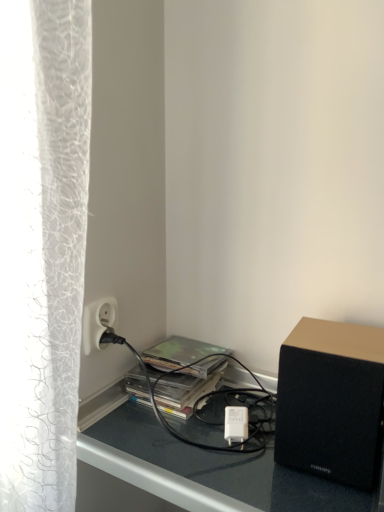
Question: Are black matte speaker at lower right and camouflage paper at center beside each other?

Choices:
 (A) yes
 (B) no

Answer: (B)

Question: Is camouflage paper at center surrounded by black matte speaker at lower right?

Choices:
 (A) no
 (B) yes

Answer: (A)

Question: Is black matte speaker at lower right positioned with its back to camouflage paper at center?

Choices:
 (A) no
 (B) yes

Answer: (A)

Question: Is black matte speaker at lower right taller than camouflage paper at center?

Choices:
 (A) no
 (B) yes

Answer: (B)

Question: From a real-world perspective, is black matte speaker at lower right physically above camouflage paper at center?

Choices:
 (A) yes
 (B) no

Answer: (A)

Question: Is white plastic power outlet at lower left inside or outside of black matte speaker at lower right?

Choices:
 (A) inside
 (B) outside

Answer: (B)

Question: Looking at their shapes, would you say white plastic power outlet at lower left is wider or thinner than black matte speaker at lower right?

Choices:
 (A) thin
 (B) wide

Answer: (A)

Question: Is white plastic power outlet at lower left taller or shorter than black matte speaker at lower right?

Choices:
 (A) tall
 (B) short

Answer: (B)

Question: From the image's perspective, is white plastic power outlet at lower left above or below black matte speaker at lower right?

Choices:
 (A) above
 (B) below

Answer: (A)

Question: From the image's perspective, relative to white plastic power outlet at lower left, is black matte speaker at lower right above or below?

Choices:
 (A) below
 (B) above

Answer: (A)

Question: In the image, is black matte speaker at lower right positioned in front of or behind white plastic power outlet at lower left?

Choices:
 (A) front
 (B) behind

Answer: (A)

Question: Considering the positions of point (349, 411) and point (99, 307), is point (349, 411) closer or farther from the camera than point (99, 307)?

Choices:
 (A) farther
 (B) closer

Answer: (B)

Question: Based on their sizes in the image, would you say black matte speaker at lower right is bigger or smaller than white plastic power outlet at lower left?

Choices:
 (A) small
 (B) big

Answer: (B)

Question: From their relative heights in the image, would you say black matte speaker at lower right is taller or shorter than camouflage paper at center?

Choices:
 (A) tall
 (B) short

Answer: (A)

Question: Does point (317, 454) appear closer or farther from the camera than point (192, 346)?

Choices:
 (A) farther
 (B) closer

Answer: (B)